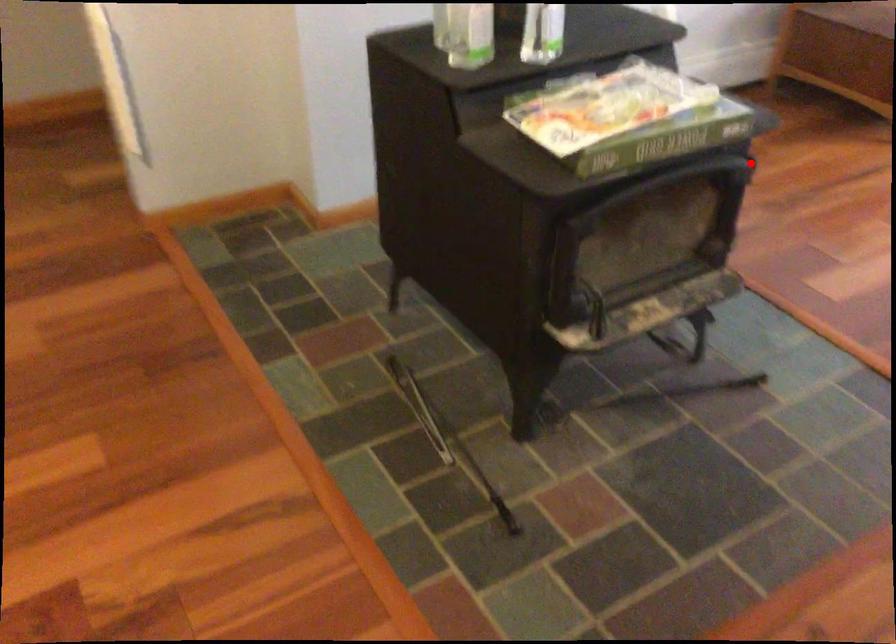
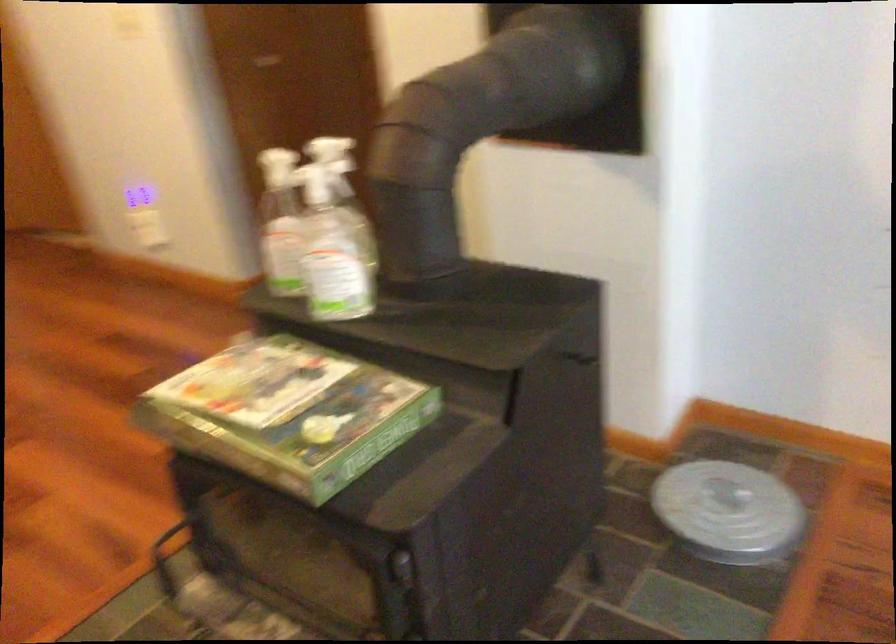
Question: I am providing you with two images of the same scene from different viewpoints. In image1, a red point is highlighted. Considering the same 3D point in image2, which of the following is correct?

Choices:
 (A) It is closer
 (B) It is farther

Answer: (A)